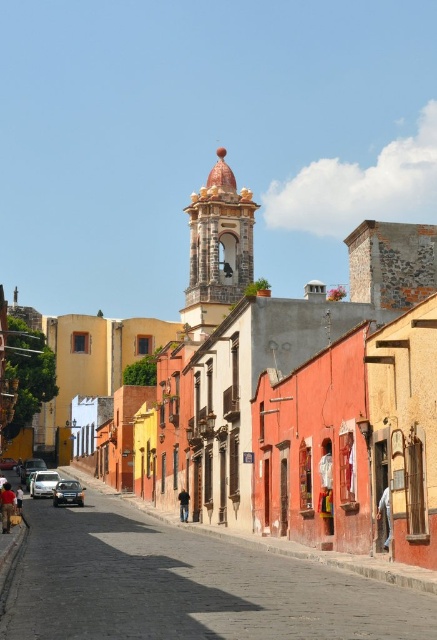
Question: Does gray fabric pants at lower right appear on the right side of matte silver car at lower left?

Choices:
 (A) no
 (B) yes

Answer: (B)

Question: Which object appears closest to the camera in this image?

Choices:
 (A) shiny silver car at center
 (B) dark blue jeans at lower left
 (C) shiny black car at center
 (D) dark brown leather jacket at lower left

Answer: (B)

Question: Which point appears closest to the camera in this image?

Choices:
 (A) (20, 467)
 (B) (181, 508)
 (C) (62, 534)

Answer: (C)

Question: Can you confirm if matte orange building at center is positioned above black leather jacket at center?

Choices:
 (A) no
 (B) yes

Answer: (B)

Question: Can you confirm if silver metallic car at center is positioned above dark blue jeans at lower left?

Choices:
 (A) no
 (B) yes

Answer: (A)

Question: Which point is farther from the camera taking this photo?

Choices:
 (A) (10, 460)
 (B) (13, 493)
 (C) (385, 509)

Answer: (A)